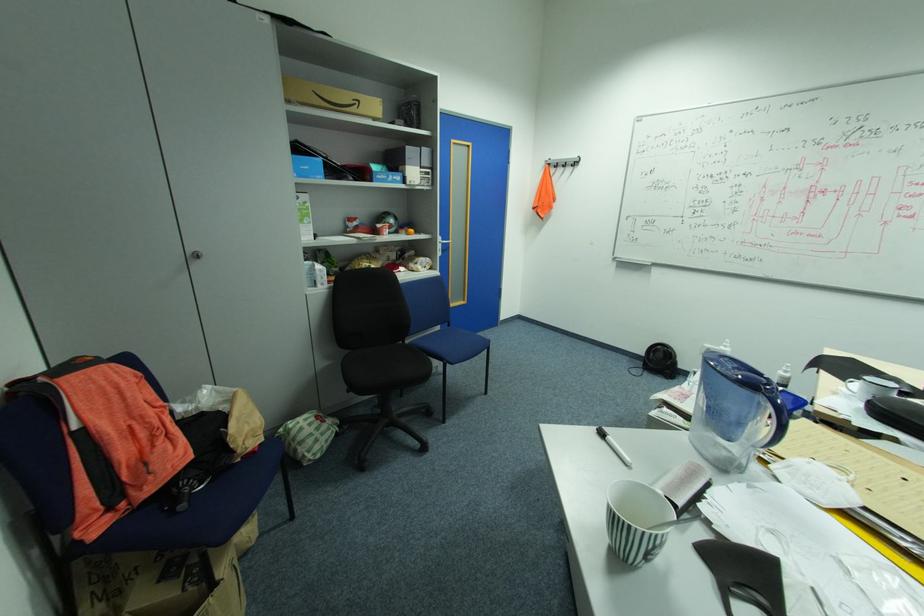
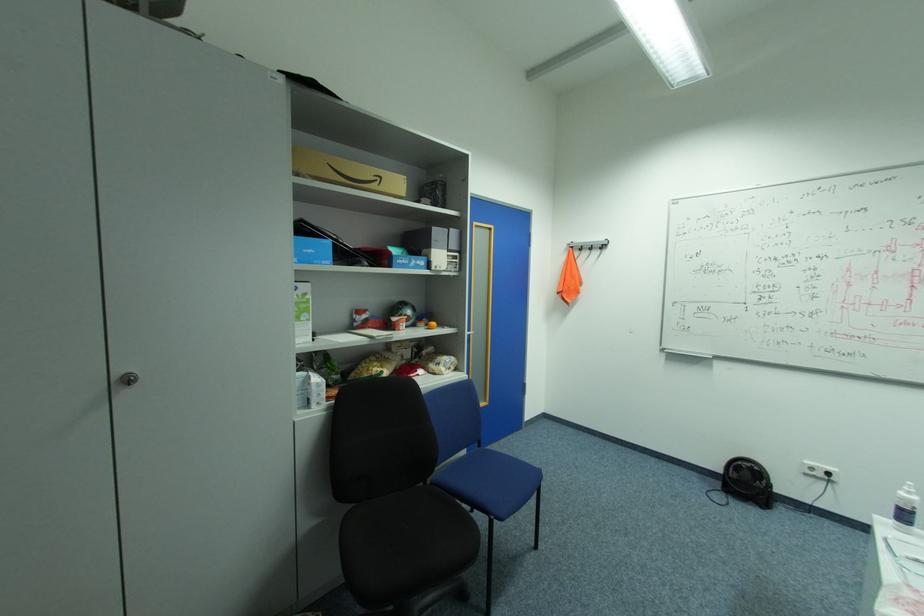
Locate, in the second image, the point that corresponds to the point at 733,347 in the first image.

(916, 493)